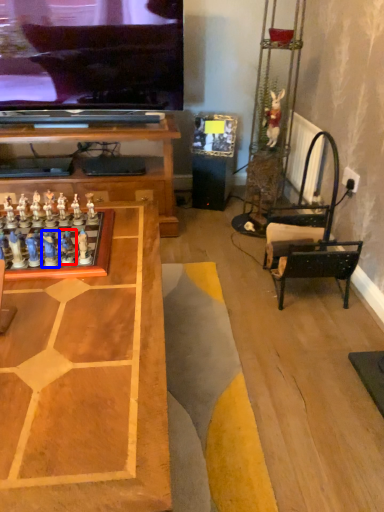
Question: Which point is closer to the camera, toy (highlighted by a red box) or toy (highlighted by a blue box)?

Choices:
 (A) toy
 (B) toy

Answer: (B)